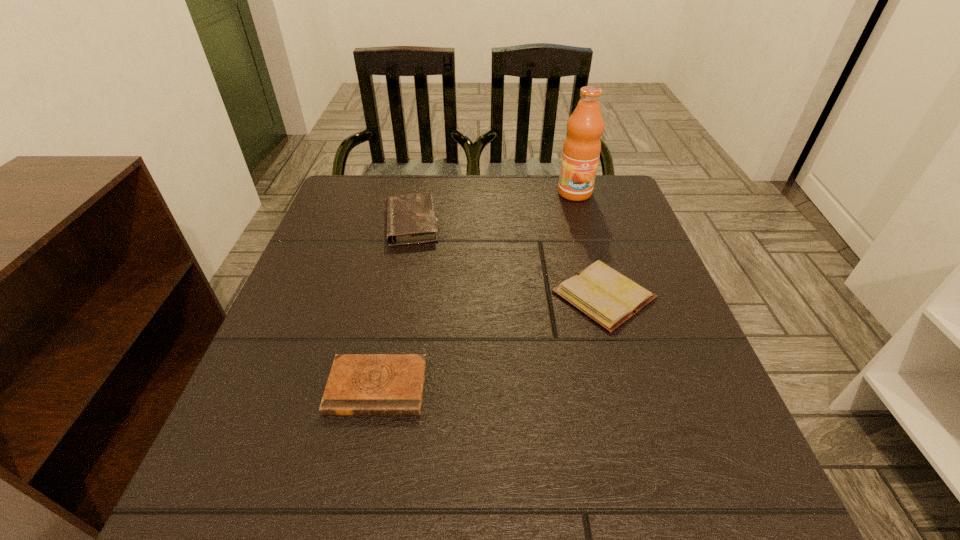
Where is `vacant position located 0.140m on the spine side of the nearest diary`? vacant position located 0.140m on the spine side of the nearest diary is located at coordinates (352, 507).

Where is `fruit juice at the far edge`? fruit juice at the far edge is located at coordinates (582, 146).

Where is `diary at the far edge`? diary at the far edge is located at coordinates (411, 218).

Locate an element on the screen. Image resolution: width=960 pixels, height=540 pixels. fruit juice located at the right edge is located at coordinates (582, 146).

Find the location of a particular element. diary situated at the right edge is located at coordinates (609, 298).

This screenshot has width=960, height=540. Find the location of `object that is at the far left corner`. object that is at the far left corner is located at coordinates (411, 218).

Find the location of a particular element. object situated at the far right corner is located at coordinates (582, 146).

You are a GUI agent. You are given a task and a screenshot of the screen. Output one action in this format:
    pyautogui.click(x=<x>, y=<y>)
    Task: Click on the vacant region at the far edge of the desktop
    The width and height of the screenshot is (960, 540).
    Given the screenshot: What is the action you would take?
    pyautogui.click(x=433, y=180)

The width and height of the screenshot is (960, 540). What are the coordinates of `free space at the near edge of the desktop` in the screenshot? It's located at (576, 510).

Locate an element on the screen. The height and width of the screenshot is (540, 960). free space at the left edge is located at coordinates (300, 274).